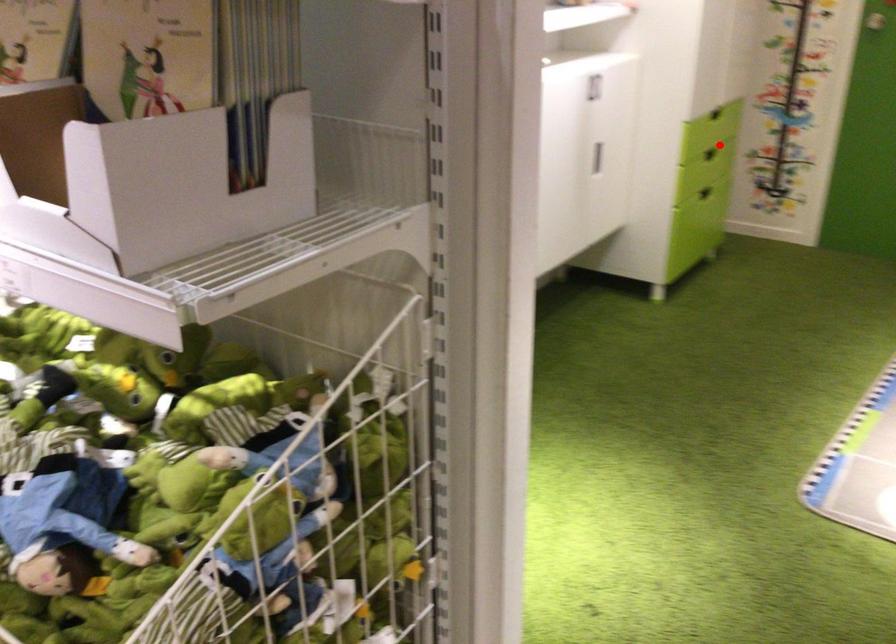
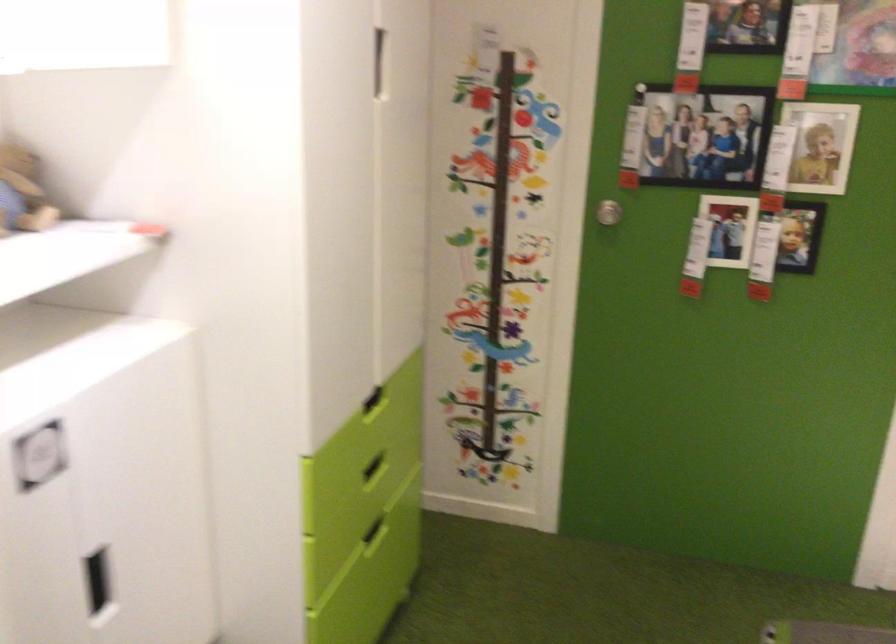
Question: I am providing you with two images of the same scene from different viewpoints. In image1, a red point is highlighted. Considering the same 3D point in image2, which of the following is correct?

Choices:
 (A) It is closer
 (B) It is farther

Answer: (A)